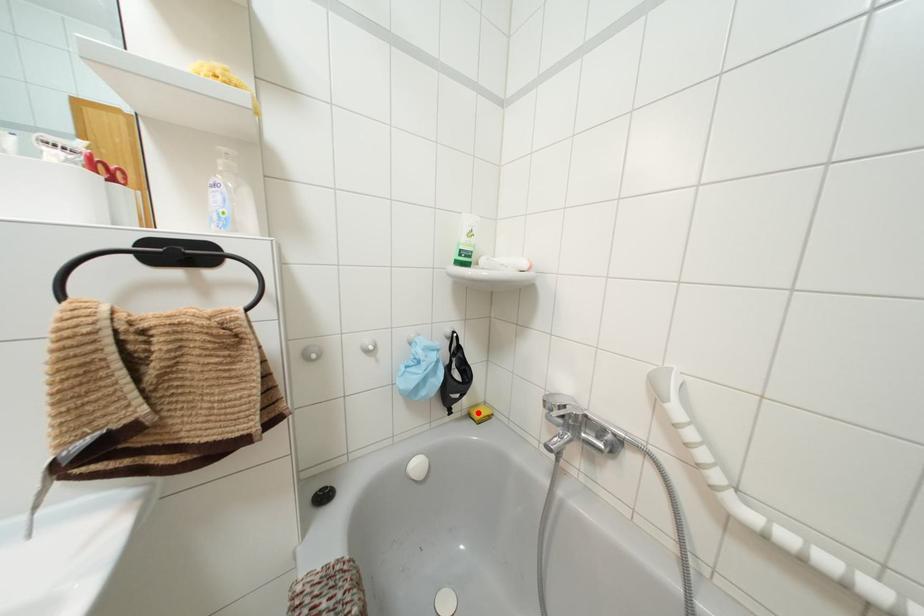
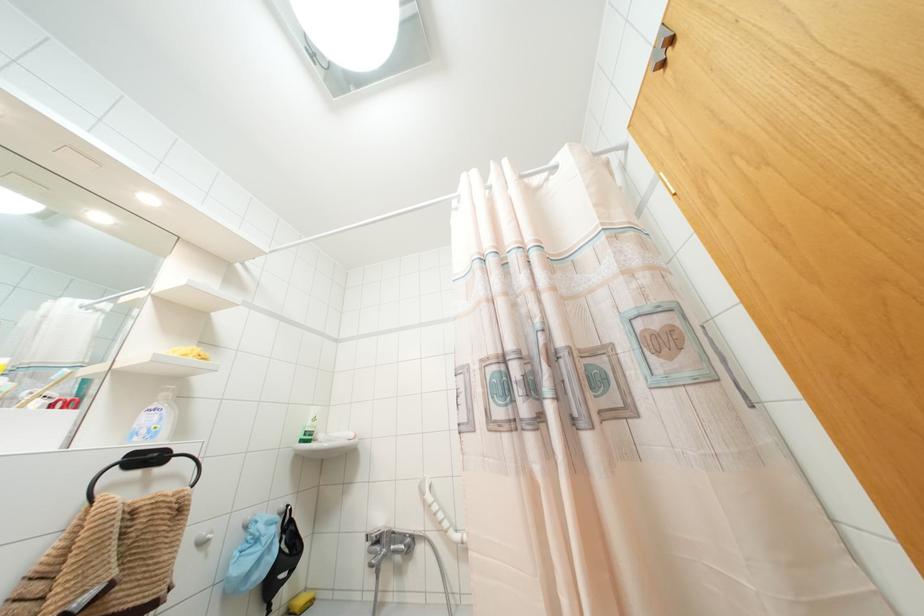
Locate, in the second image, the point that corresponds to the highlighted location in the first image.

(299, 601)